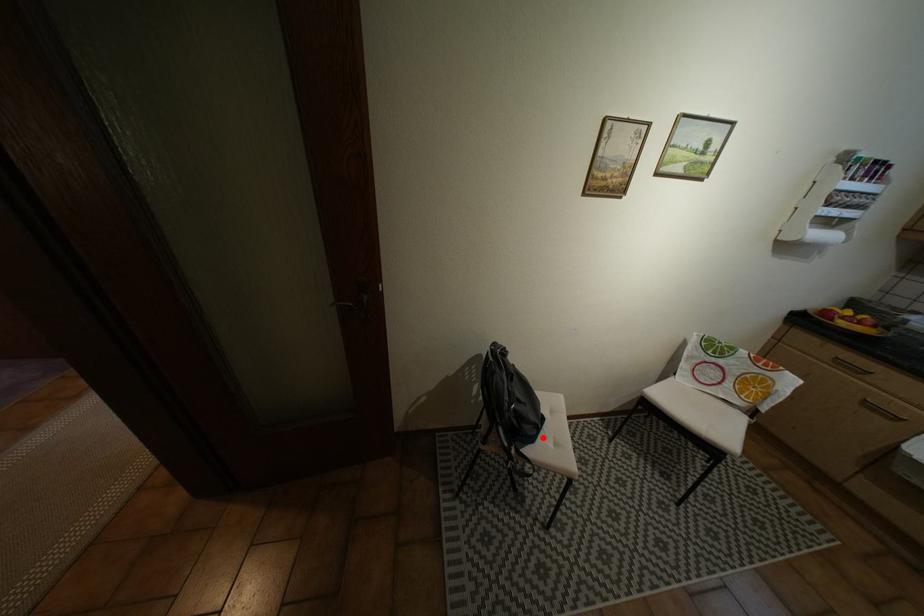
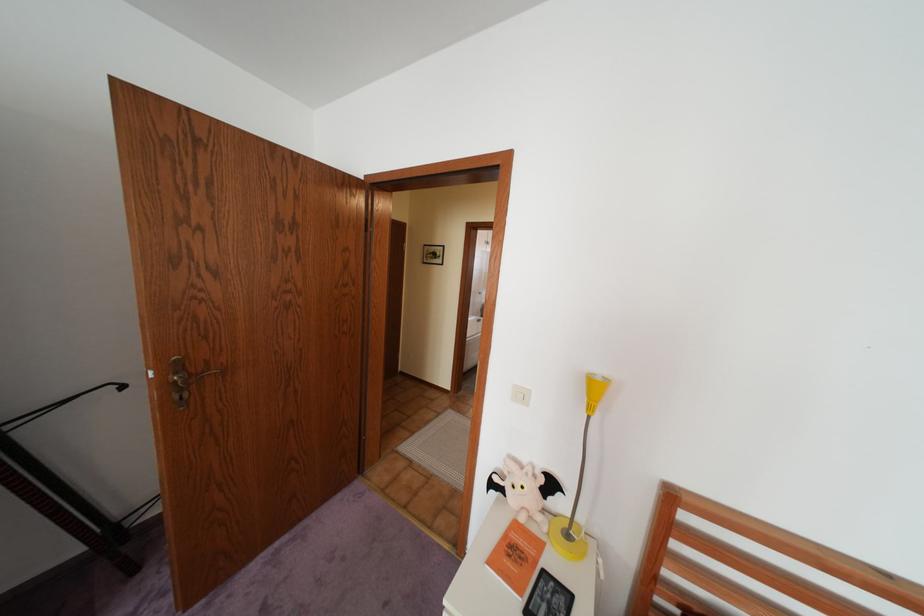
Question: I am providing you with two images of the same scene from different viewpoints. A red point is marked on the first image. Can you still see the location of the red point in image 2?

Choices:
 (A) Yes
 (B) No

Answer: (B)